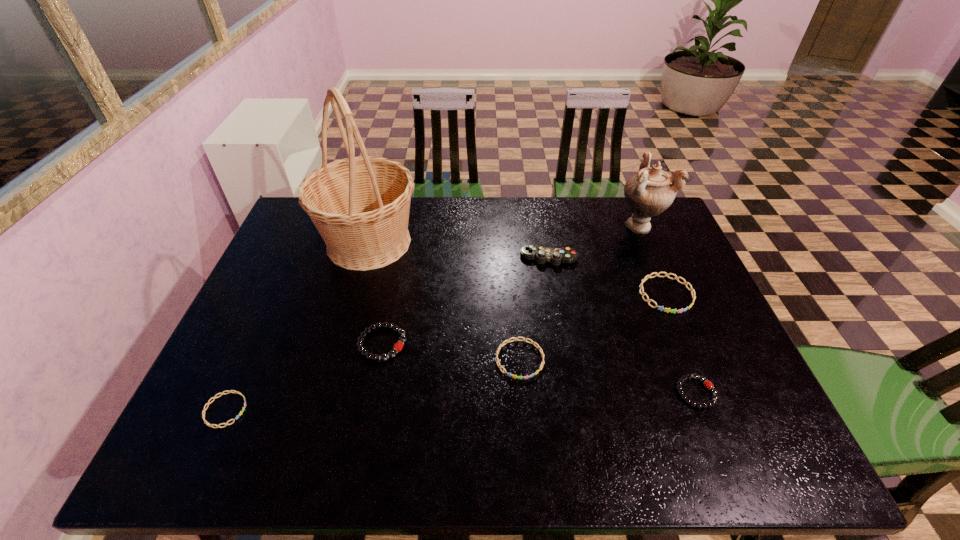
Locate an element on the screen. This screenshot has width=960, height=540. free space between the biggest blue bracelet and the tallest object is located at coordinates (517, 268).

What are the coordinates of `vacant region between the smallest blue bracelet and the third tallest object` in the screenshot? It's located at (387, 334).

The height and width of the screenshot is (540, 960). I want to click on object that is the second closest one to the left black bracelet, so click(524, 339).

Where is `the fourth closest object to the right black bracelet`? the fourth closest object to the right black bracelet is located at coordinates (648, 193).

Locate an element on the screen. Image resolution: width=960 pixels, height=540 pixels. bracelet object that ranks as the fourth closest to the urn is located at coordinates (397, 347).

At what (x,y) coordinates should I click in order to perform the action: click on bracelet identified as the second closest to the urn. Please return your answer as a coordinate pair (x, y). This screenshot has width=960, height=540. Looking at the image, I should click on (524, 339).

Identify the location of blue bracelet that stands as the second closest to the second blue bracelet from left to right. This screenshot has width=960, height=540. (243, 408).

Locate which blue bracelet is the second closest to the rightmost blue bracelet. Please provide its 2D coordinates. Your answer should be formatted as a tuple, i.e. [(x, y)], where the tuple contains the x and y coordinates of a point satisfying the conditions above.

[(243, 408)]

The height and width of the screenshot is (540, 960). I want to click on vacant area in the image that satisfies the following two spatial constraints: 1. on the back side of the sixth shortest object; 2. on the left side of the fourth bracelet from right to left, so click(x=399, y=257).